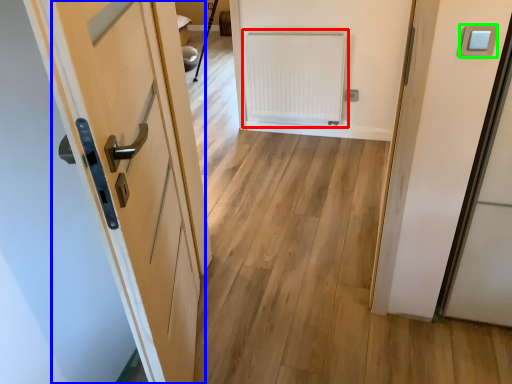
Question: Which object is the closest to the radiator (highlighted by a red box)? Choose among these: door (highlighted by a blue box) or light switch (highlighted by a green box).

Choices:
 (A) door
 (B) light switch

Answer: (A)